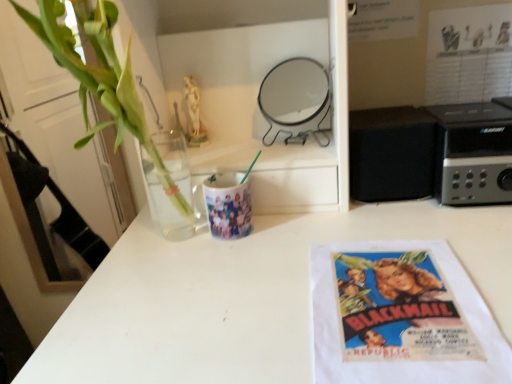
Image resolution: width=512 pixels, height=384 pixels. I want to click on blank space situated above white paper towel at lower right (from a real-world perspective), so click(x=401, y=291).